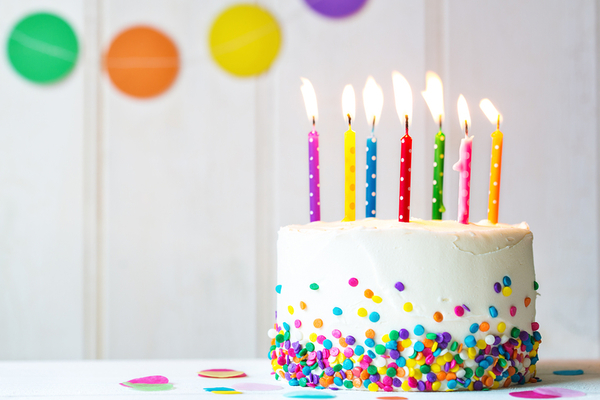
Locate an element on the screen. The height and width of the screenshot is (400, 600). candle flames is located at coordinates (309, 102), (348, 102), (375, 94), (400, 88), (430, 91), (462, 110), (484, 107).